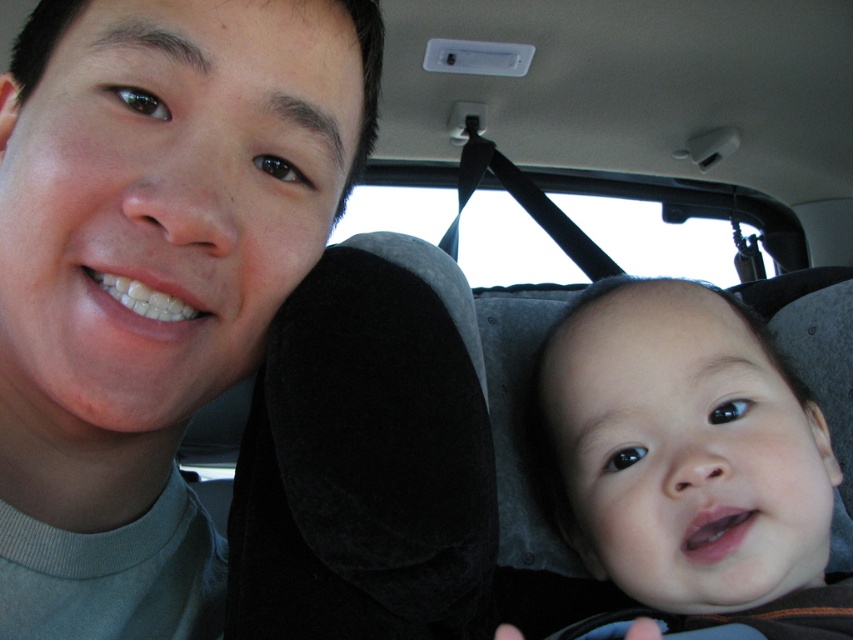
Consider the image. You are designing a car interior layout and need to ensure there is enough space between the matte gray headrest at left and the smooth skin baby at right. Based on the image, which object has a smaller width and therefore requires less space?

The matte gray headrest at left has a smaller width than the smooth skin baby at right, so it requires less space.

You are a passenger in the car and want to adjust the headrest. The matte gray headrest at left is located at point 0.433, 0.179. Is it positioned closer to the front or the back of the car?

The matte gray headrest at left is positioned closer to the front of the car because its coordinates are at [152,276], which places it near the front section of the car.

Looking at this image, you are sitting in the backseat of a car and want to hand a toy to the smooth skin baby at right. The toy is currently on the matte gray headrest at left. Can you reach the toy without moving your body?

The matte gray headrest at left is closer to you than the smooth skin baby at right, so you can reach the toy on the matte gray headrest at left easily without moving your body.